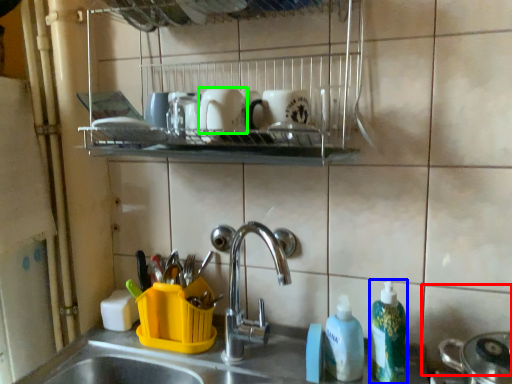
Question: Considering the real-world distances, which object is closest to tile (highlighted by a red box)? cleaning product (highlighted by a blue box) or mug (highlighted by a green box).

Choices:
 (A) cleaning product
 (B) mug

Answer: (A)